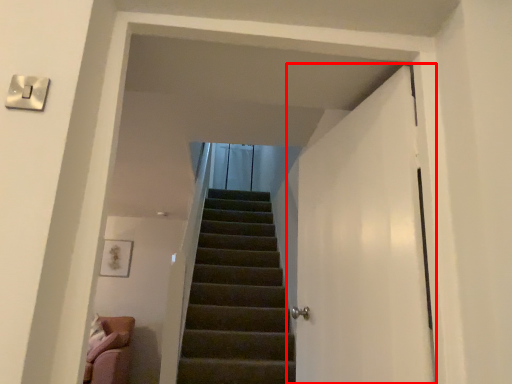
Question: From the image's perspective, what is the correct spatial positioning of door (annotated by the red box) in reference to electric outlet?

Choices:
 (A) below
 (B) above

Answer: (A)